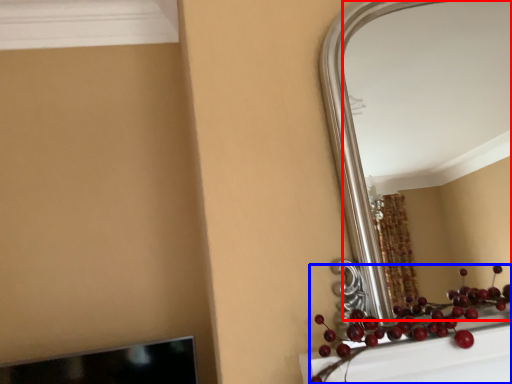
Question: Which object appears closest to the camera in this image, mirror (highlighted by a red box) or fruit (highlighted by a blue box)?

Choices:
 (A) mirror
 (B) fruit

Answer: (B)